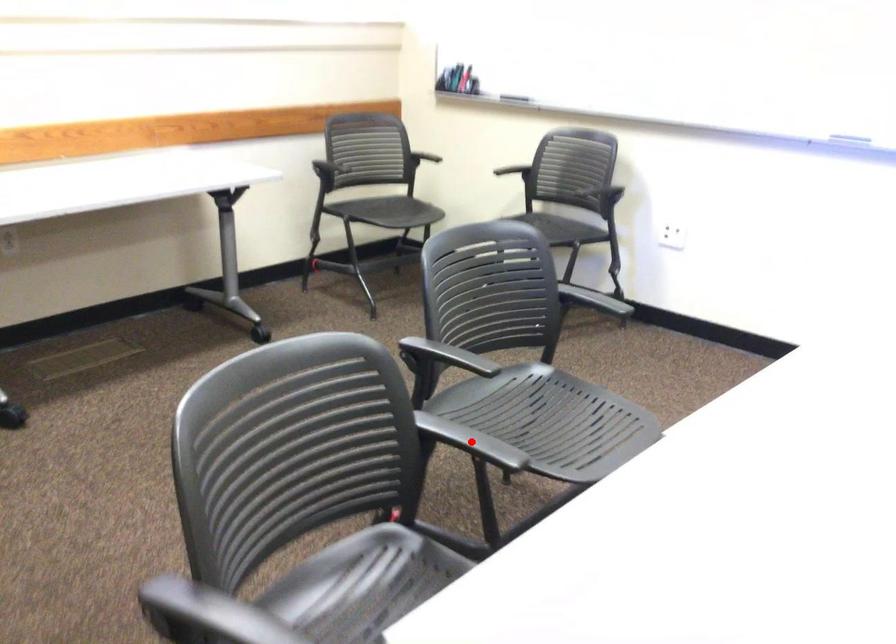
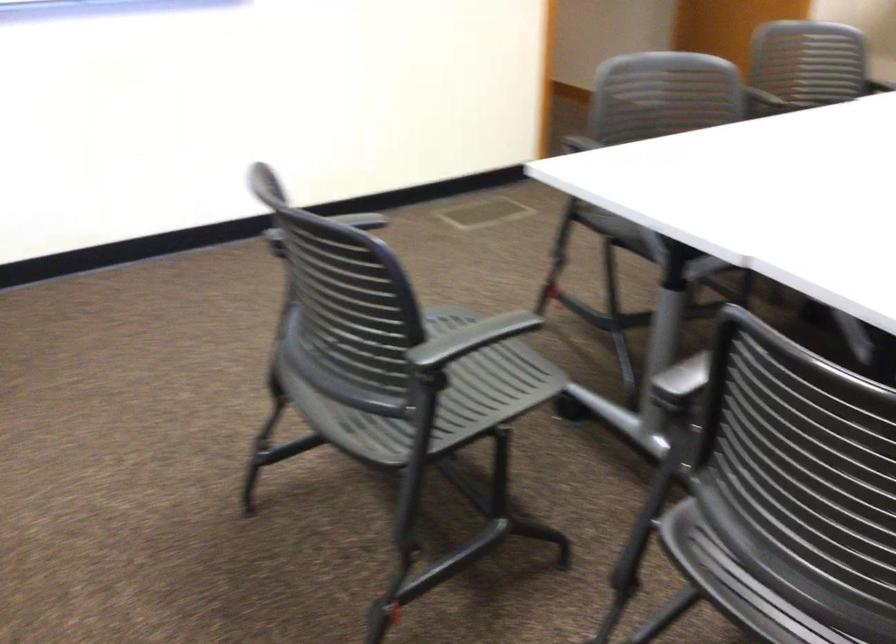
Question: I am providing you with two images of the same scene from different viewpoints. A red point is marked on the first image. At the location where the point appears in image 1, is it still visible in image 2?

Choices:
 (A) Yes
 (B) No

Answer: (B)